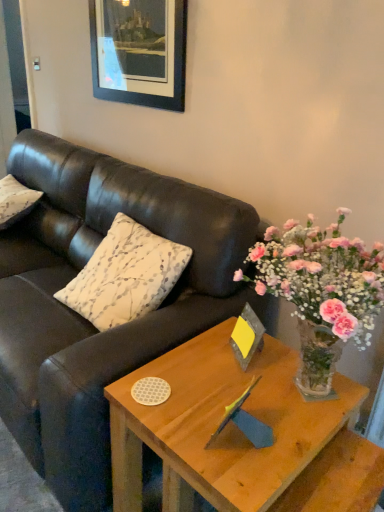
Question: From the image's perspective, is matte black couch at center located above light brown wood coffee table at center?

Choices:
 (A) no
 (B) yes

Answer: (B)

Question: Considering the relative sizes of matte black couch at center and light brown wood coffee table at center in the image provided, is matte black couch at center wider than light brown wood coffee table at center?

Choices:
 (A) yes
 (B) no

Answer: (A)

Question: Can light brown wood coffee table at center be found inside matte black couch at center?

Choices:
 (A) no
 (B) yes

Answer: (A)

Question: Does matte black couch at center lie behind light brown wood coffee table at center?

Choices:
 (A) yes
 (B) no

Answer: (A)

Question: Is the position of matte black couch at center less distant than that of light brown wood coffee table at center?

Choices:
 (A) yes
 (B) no

Answer: (B)

Question: Looking at their shapes, would you say white textured pillow at left, positioned as the first pillow in left-to-right order, is wider or thinner than matte black couch at center?

Choices:
 (A) thin
 (B) wide

Answer: (A)

Question: Is white textured pillow at left, the 2th pillow from the right, taller or shorter than matte black couch at center?

Choices:
 (A) tall
 (B) short

Answer: (B)

Question: Is white textured pillow at left, placed as the 2th pillow when sorted from front to back, inside or outside of matte black couch at center?

Choices:
 (A) inside
 (B) outside

Answer: (A)

Question: Considering the relative positions of white textured pillow at left, the 2th pillow from the right, and matte black couch at center in the image provided, is white textured pillow at left, the 2th pillow from the right, to the left or to the right of matte black couch at center?

Choices:
 (A) left
 (B) right

Answer: (A)

Question: Based on their positions, is matte black couch at center located to the left or right of light brown wood coffee table at center?

Choices:
 (A) right
 (B) left

Answer: (B)

Question: Considering the positions of matte black couch at center and light brown wood coffee table at center in the image, is matte black couch at center taller or shorter than light brown wood coffee table at center?

Choices:
 (A) short
 (B) tall

Answer: (B)

Question: From a real-world perspective, is matte black couch at center physically located above or below light brown wood coffee table at center?

Choices:
 (A) below
 (B) above

Answer: (B)

Question: Is matte black couch at center situated inside light brown wood coffee table at center or outside?

Choices:
 (A) outside
 (B) inside

Answer: (A)

Question: From the image's perspective, is wooden picture frame at upper center, the 2th picture frame viewed from the right, above or below wooden block with yellow card at center, the 2th picture frame from the left?

Choices:
 (A) below
 (B) above

Answer: (B)

Question: Which is correct: wooden picture frame at upper center, which is counted as the second picture frame, starting from the front, is inside wooden block with yellow card at center, the first picture frame in the front-to-back sequence, or outside of it?

Choices:
 (A) outside
 (B) inside

Answer: (A)